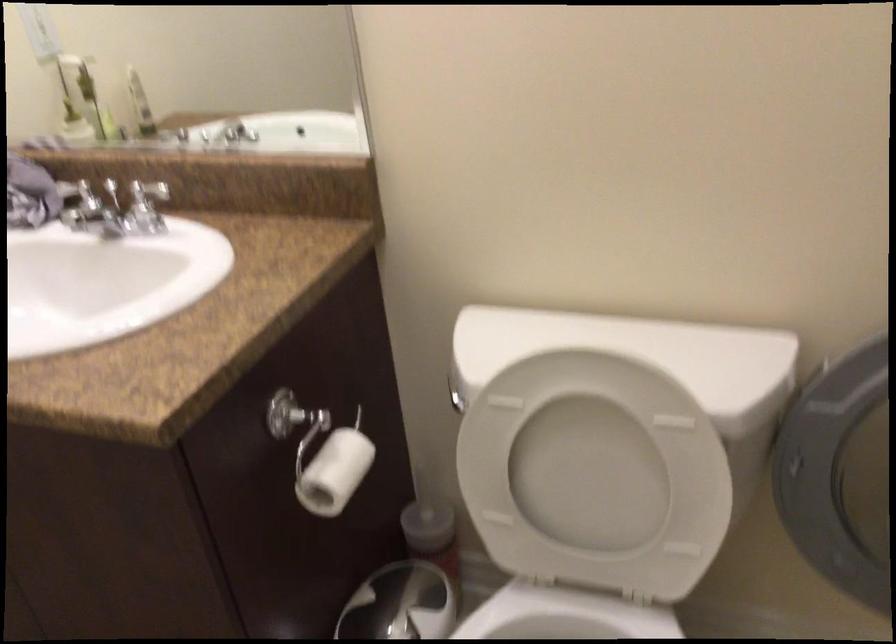
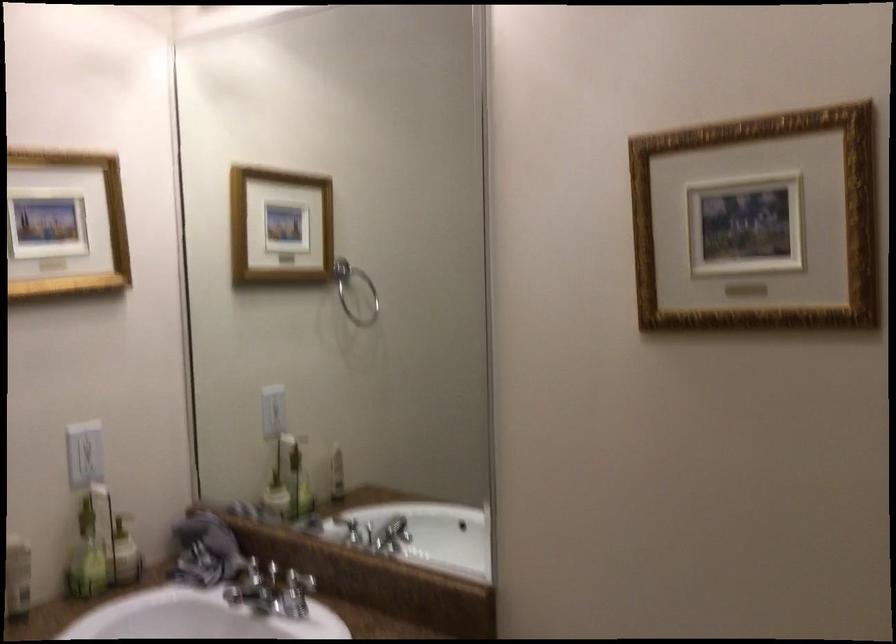
Which direction would the cameraman need to move to produce the second image?

The cameraman walked toward right, backward.